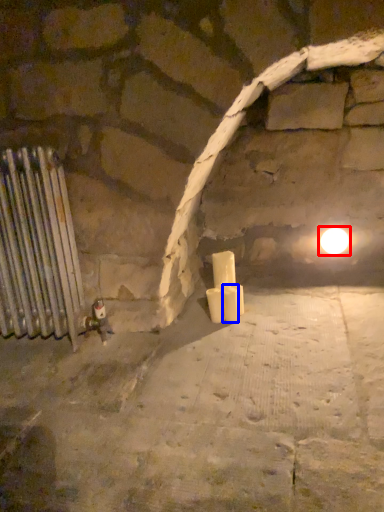
Question: Which object is closer to the camera taking this photo, light (highlighted by a red box) or candle (highlighted by a blue box)?

Choices:
 (A) light
 (B) candle

Answer: (B)